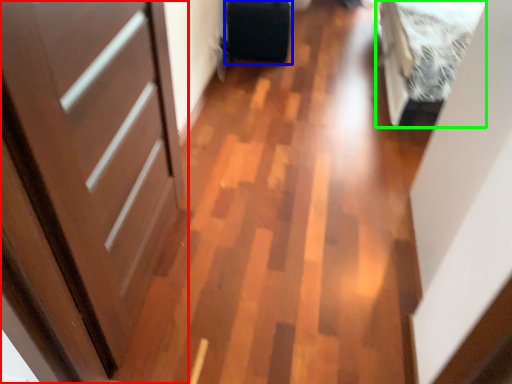
Question: Which object is positioned closest to door (highlighted by a red box)? Select from luggage (highlighted by a blue box) and bed (highlighted by a green box).

Choices:
 (A) luggage
 (B) bed

Answer: (B)